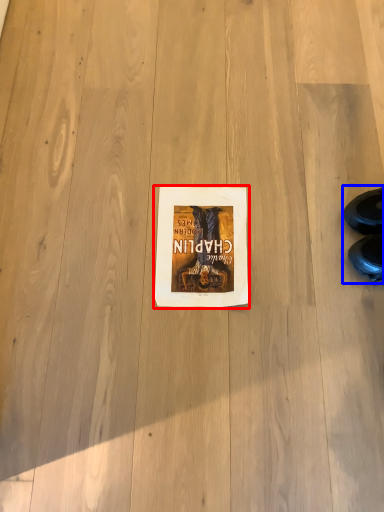
Question: Which point is further to the camera, paperback book (highlighted by a red box) or leather shoe (highlighted by a blue box)?

Choices:
 (A) paperback book
 (B) leather shoe

Answer: (A)